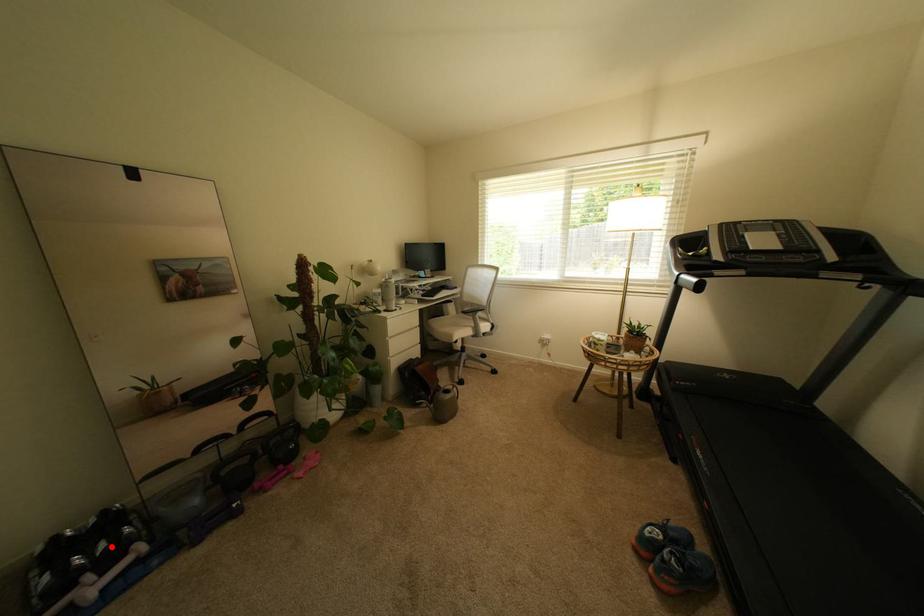
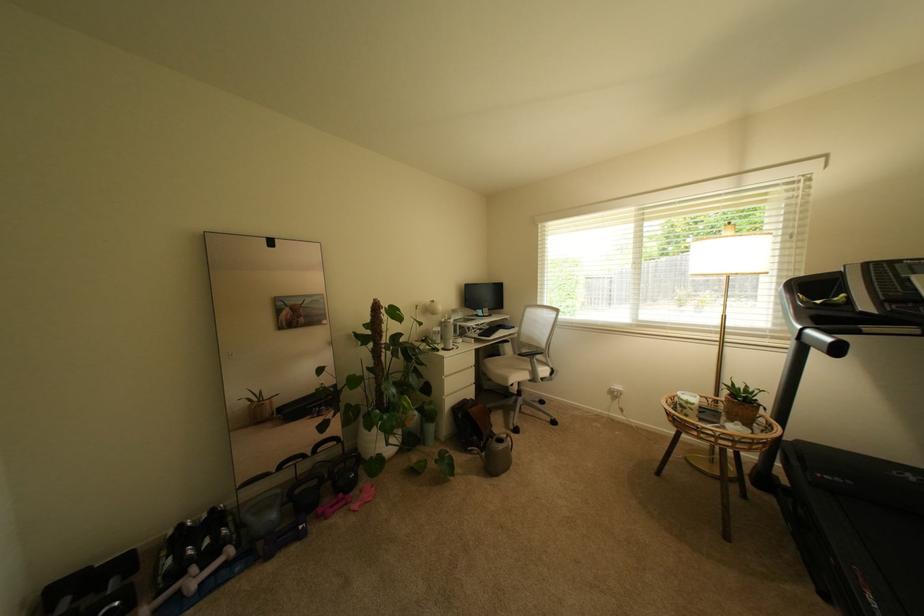
In the second image, find the point that corresponds to the highlighted location in the first image.

(215, 543)